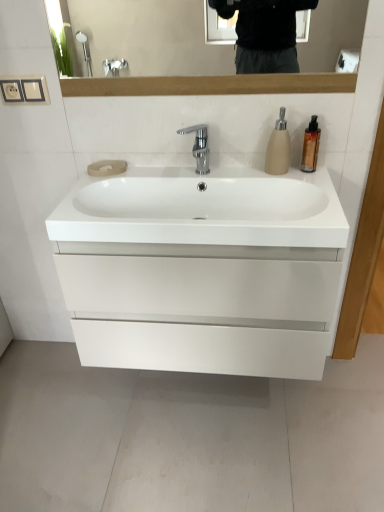
Where is `free space to the left of matte beige soap dispenser at upper right, arranged as the second soap dispenser when viewed from the right`? free space to the left of matte beige soap dispenser at upper right, arranged as the second soap dispenser when viewed from the right is located at coordinates (246, 168).